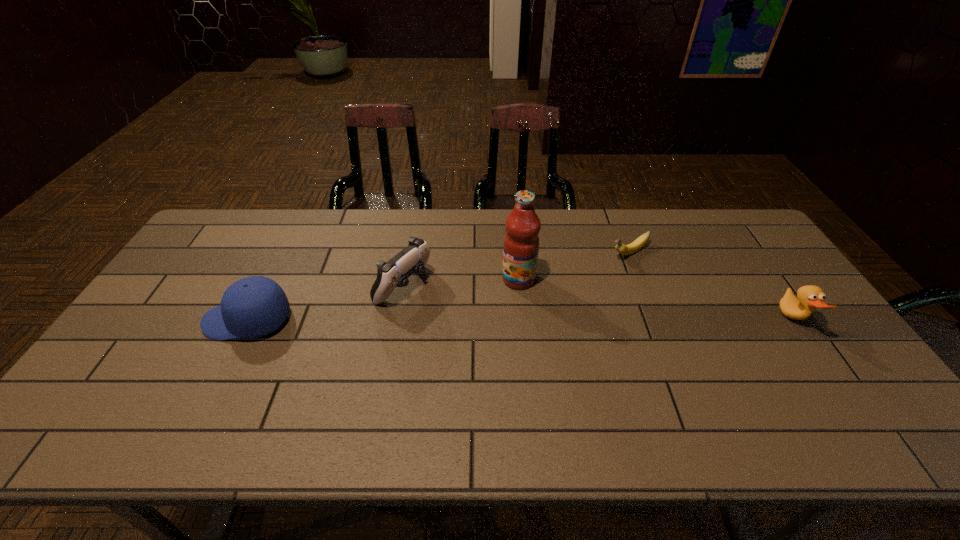
You are a GUI agent. You are given a task and a screenshot of the screen. Output one action in this format:
    pyautogui.click(x=<x>, y=<y>)
    Task: Click on the vacant region located 0.110m on the front-facing side of the second object from left to right
    
    Given the screenshot: What is the action you would take?
    pyautogui.click(x=455, y=315)

The width and height of the screenshot is (960, 540). Find the location of `free space located on the front-facing side of the second object from left to right`. free space located on the front-facing side of the second object from left to right is located at coordinates (x=455, y=315).

In order to click on vacant position located 0.400m on the front-facing side of the second object from left to right in this screenshot , I will do `click(546, 363)`.

Locate an element on the screen. free spot located at the stem of the shortest object is located at coordinates (567, 285).

Identify the location of vacant space located at the stem of the shortest object. (553, 293).

Where is `blank space located 0.210m at the stem of the shortest object`? blank space located 0.210m at the stem of the shortest object is located at coordinates pos(564,286).

Find the location of a particular element. The height and width of the screenshot is (540, 960). vacant space located on the front label of the fruit juice is located at coordinates (492, 296).

Find the location of a particular element. Image resolution: width=960 pixels, height=540 pixels. vacant space located on the front label of the fruit juice is located at coordinates pyautogui.click(x=440, y=328).

In order to click on free region located on the front label of the fruit juice in this screenshot , I will do `click(412, 345)`.

Find the location of a particular element. This screenshot has height=540, width=960. object at the far edge is located at coordinates (636, 245).